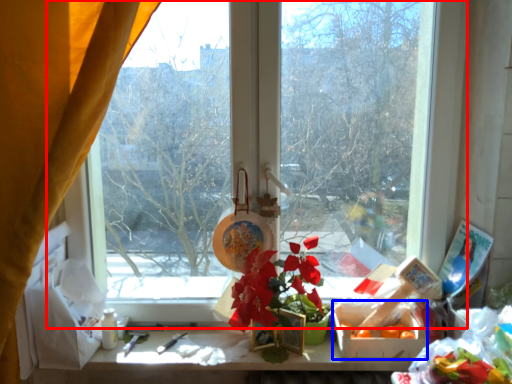
Question: Which of the following is the farthest to the observer, window (highlighted by a red box) or flower box (highlighted by a blue box)?

Choices:
 (A) window
 (B) flower box

Answer: (A)